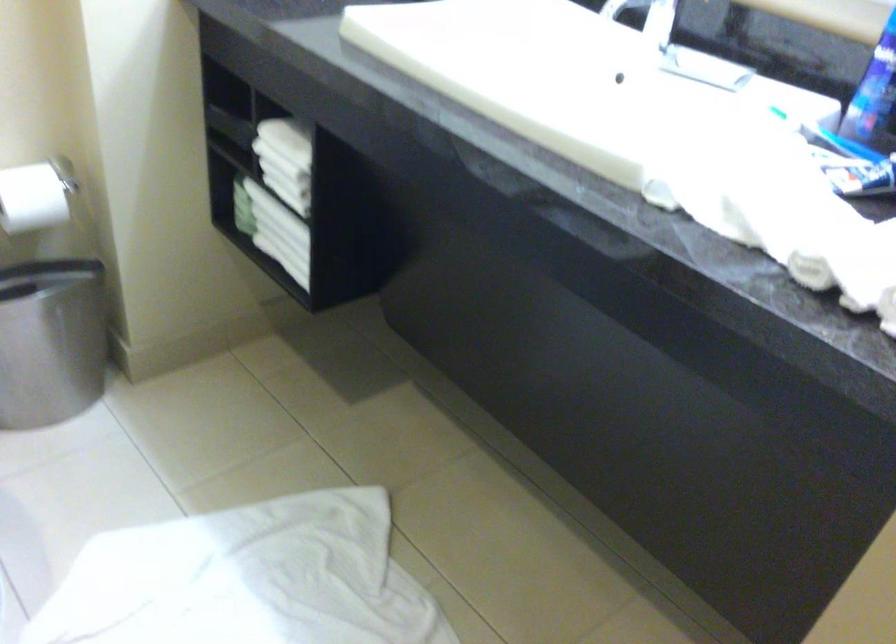
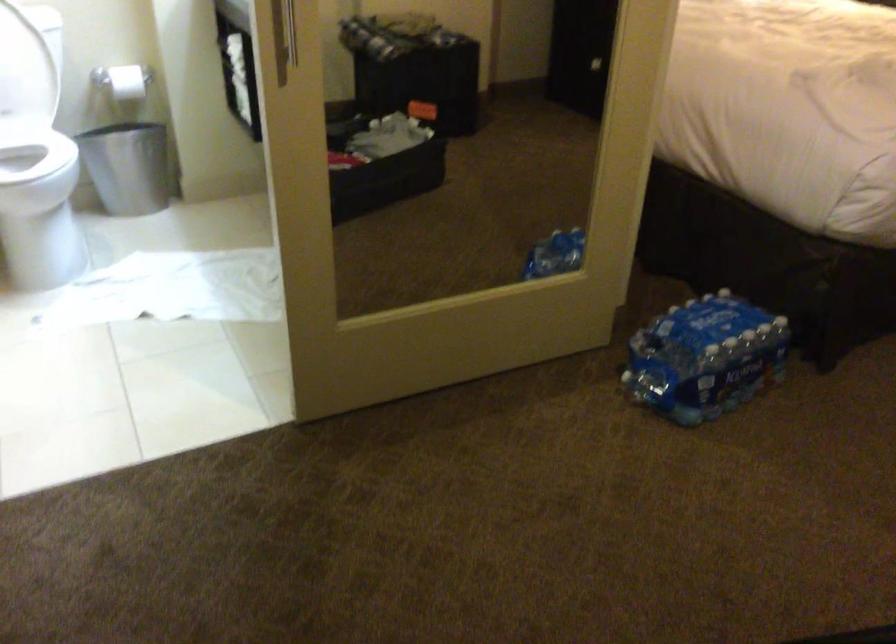
What movement of the cameraman would produce the second image?

The cameraman moved toward right, backward.